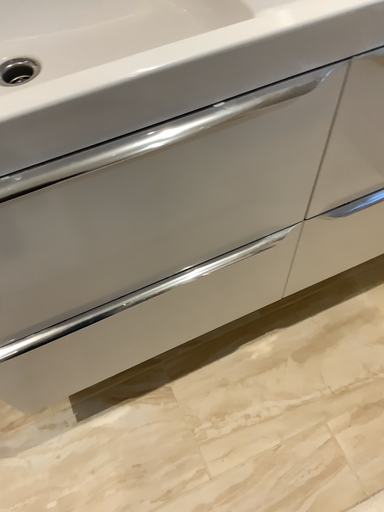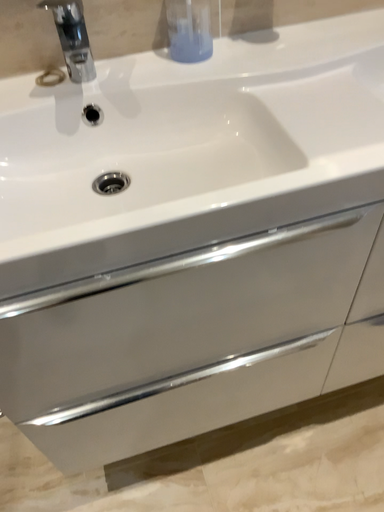
Question: Which way did the camera rotate in the video?

Choices:
 (A) rotated downward
 (B) rotated upward

Answer: (B)